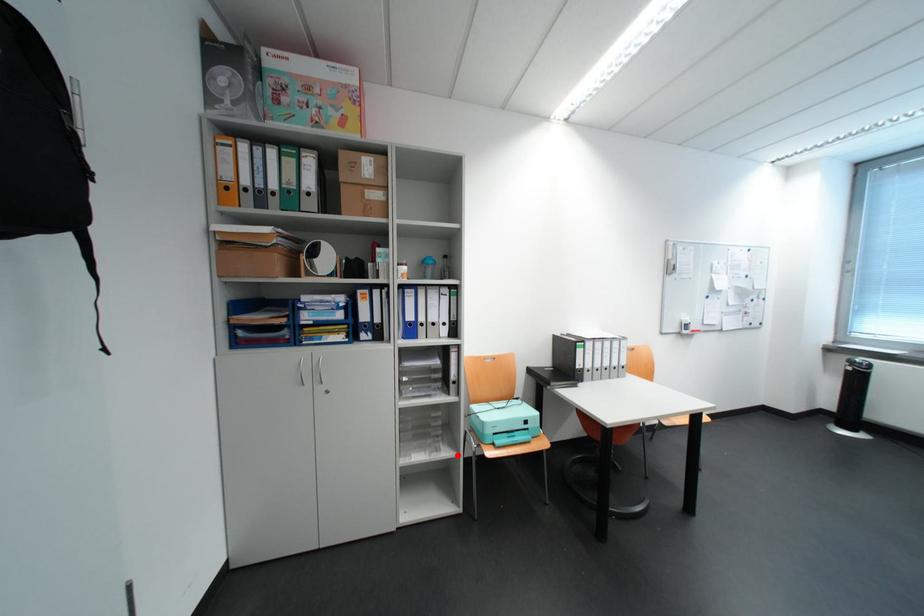
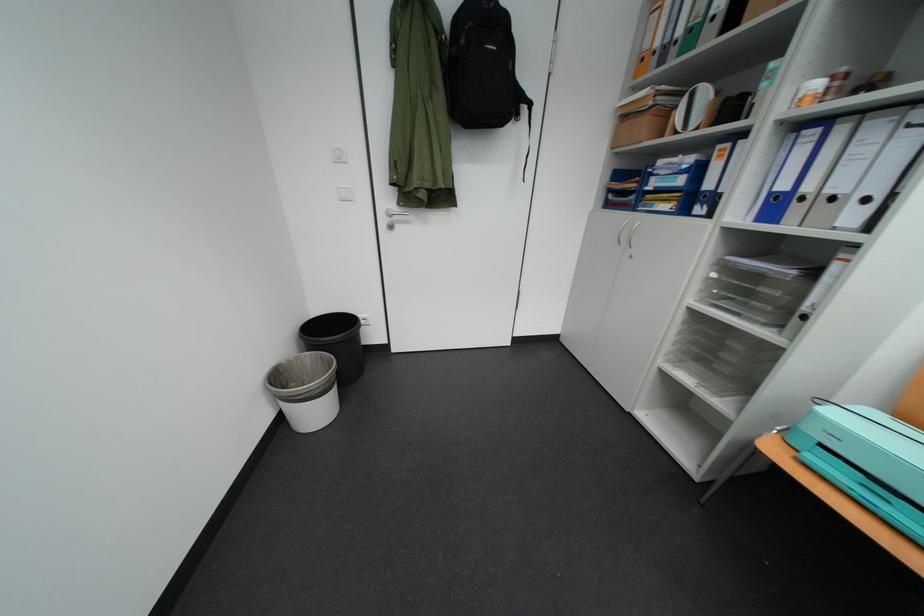
The point at the highlighted location is marked in the first image. Where is the corresponding point in the second image?

(730, 403)